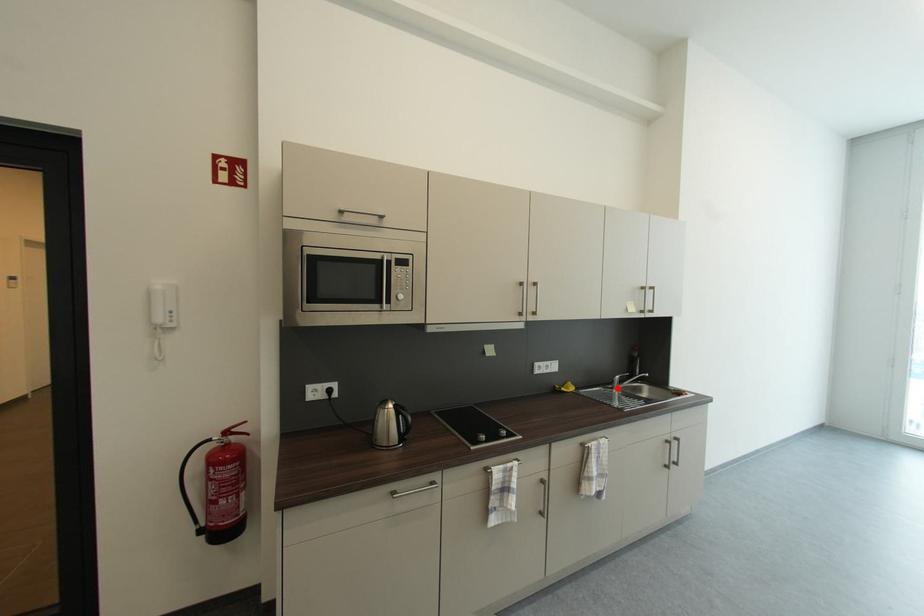
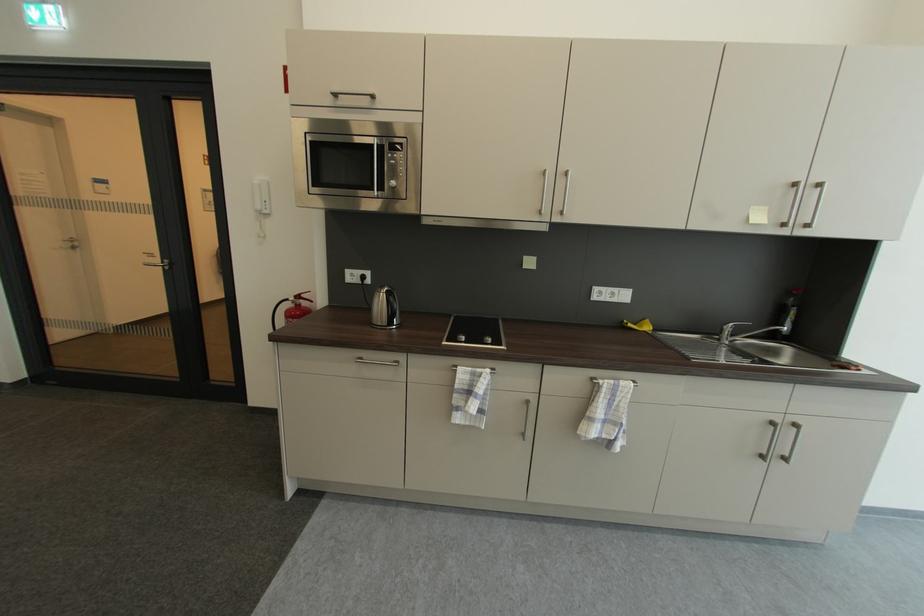
The point at the highlighted location is marked in the first image. Where is the corresponding point in the second image?

(723, 339)